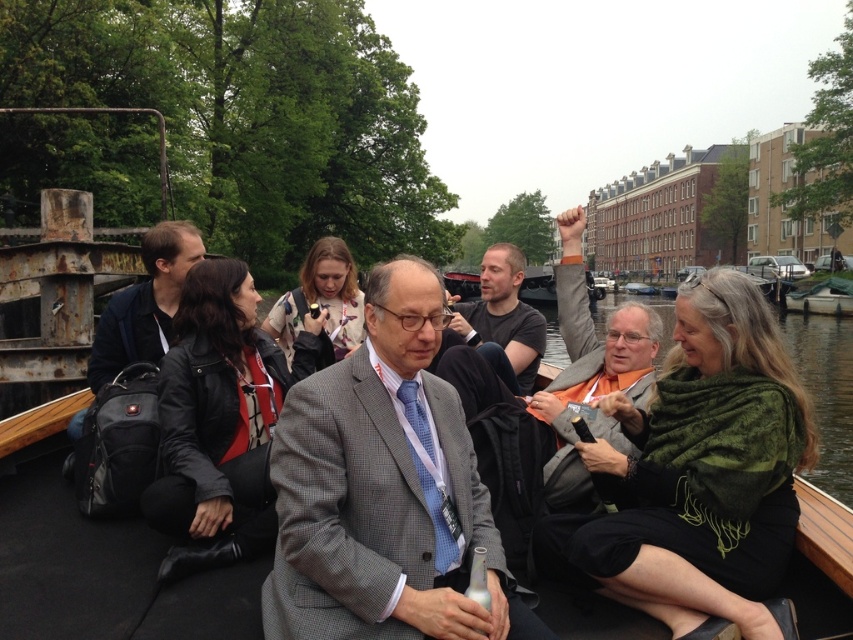
You are a photographer trying to capture a closeup shot of the dark blue fabric jacket at left and the green scarf at upper right. Since you want both items to appear similarly sized in the photo, which object should you move closer to the camera?

You should move the dark blue fabric jacket at left closer to the camera because it is smaller in size compared to the green scarf at upper right.

You are a photographer taking a picture of the group on the boat. You want to ensure both the gray checkered suit at center and the dark gray shirt at center are clearly visible in the photo. Given their sizes, which one might you need to adjust your camera angle to capture fully?

The gray checkered suit at center is much taller than the dark gray shirt at center, so you might need to adjust your camera angle to capture the taller gray checkered suit at center fully in the photo.